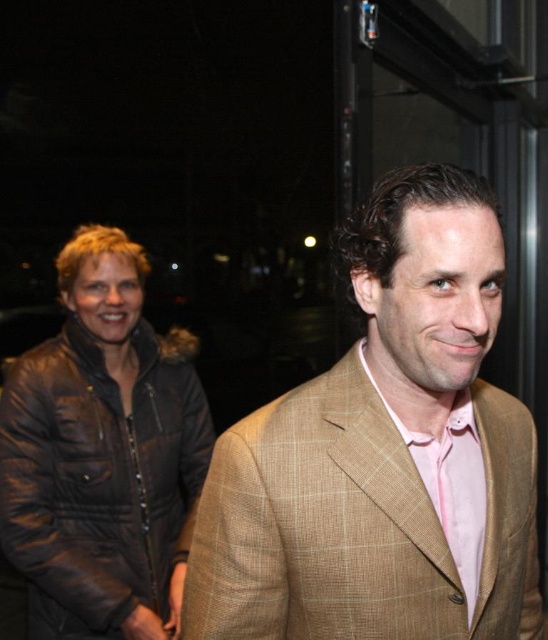
Which is more to the left, tan plaid suit at center or brown leather jacket at left?

brown leather jacket at left is more to the left.

Measure the distance between tan plaid suit at center and camera.

They are 26.09 inches apart.

Who is more forward, (328, 513) or (172, 538)?

Positioned in front is point (328, 513).

Locate an element on the screen. Image resolution: width=548 pixels, height=640 pixels. tan plaid suit at center is located at coordinates (384, 452).